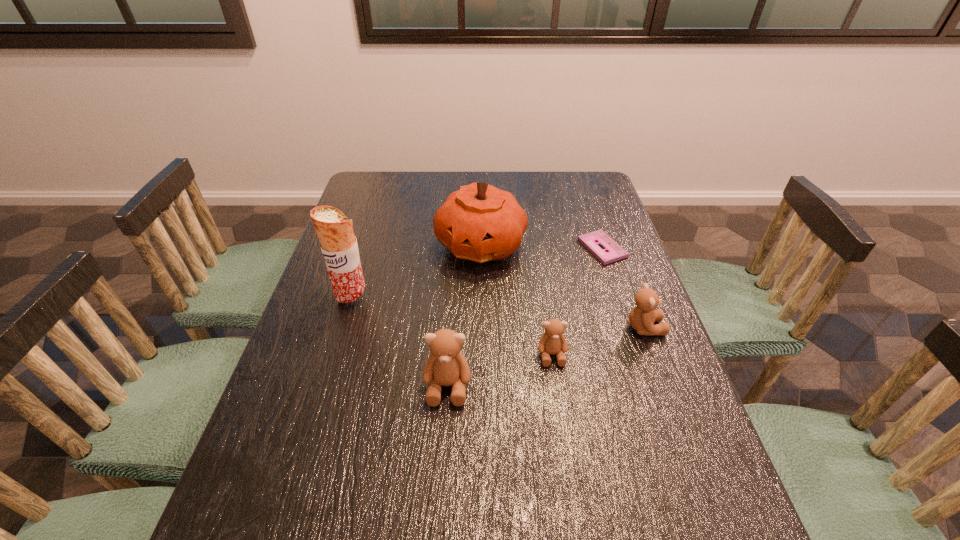
Find the location of a particular element. This screenshot has width=960, height=540. free space located 0.150m on the front-facing side of the leftmost teddy bear is located at coordinates (442, 479).

At what (x,y) coordinates should I click in order to perform the action: click on vacant area situated 0.100m on the front-facing side of the second teddy bear from left to right. Please return your answer as a coordinate pair (x, y). The height and width of the screenshot is (540, 960). Looking at the image, I should click on (560, 406).

At what (x,y) coordinates should I click in order to perform the action: click on vacant space located 0.060m on the front-facing side of the second tallest object. Please return your answer as a coordinate pair (x, y). Looking at the image, I should click on (481, 289).

You are a GUI agent. You are given a task and a screenshot of the screen. Output one action in this format:
    pyautogui.click(x=<x>, y=<y>)
    Task: Click on the free spot located on the left of the videotape
    
    Given the screenshot: What is the action you would take?
    pyautogui.click(x=465, y=248)

Identify the location of free space located on the back of the burrito. This screenshot has width=960, height=540. (374, 225).

Find the location of a particular element. object located in the left edge section of the desktop is located at coordinates (338, 244).

The width and height of the screenshot is (960, 540). Find the location of `teddy bear located in the right edge section of the desktop`. teddy bear located in the right edge section of the desktop is located at coordinates (642, 317).

This screenshot has height=540, width=960. What are the coordinates of `videotape that is positioned at the right edge` in the screenshot? It's located at (613, 251).

This screenshot has height=540, width=960. In the image, there is a desktop. In order to click on free space at the far edge in this screenshot , I will do `click(523, 171)`.

In the image, there is a desktop. In order to click on vacant space at the left edge in this screenshot , I will do `click(274, 414)`.